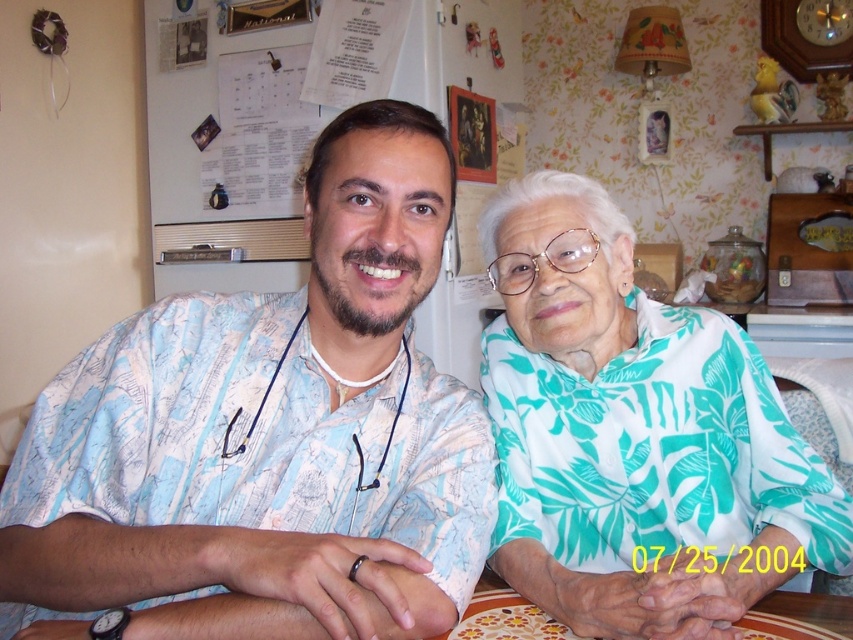
Can you confirm if white printed shirt at center is positioned to the left of teal leaf-patterned blouse at center-right?

Yes, white printed shirt at center is to the left of teal leaf-patterned blouse at center-right.

Measure the distance from white printed shirt at center to teal leaf-patterned blouse at center-right.

A distance of 10.39 inches exists between white printed shirt at center and teal leaf-patterned blouse at center-right.

Who is more forward, (378, 506) or (654, 538)?

Positioned in front is point (378, 506).

Find the location of a particular element. The image size is (853, 640). white printed shirt at center is located at coordinates (267, 438).

Does teal leaf-patterned blouse at center-right appear under floral-patterned table at center?

Actually, teal leaf-patterned blouse at center-right is above floral-patterned table at center.

Does teal leaf-patterned blouse at center-right lie behind floral-patterned table at center?

No, it is in front of floral-patterned table at center.

Is point (630, 282) farther from viewer compared to point (764, 609)?

That is True.

Find the location of a particular element. teal leaf-patterned blouse at center-right is located at coordinates (635, 435).

Where is `white printed shirt at center`? white printed shirt at center is located at coordinates pyautogui.click(x=267, y=438).

I want to click on white printed shirt at center, so click(x=267, y=438).